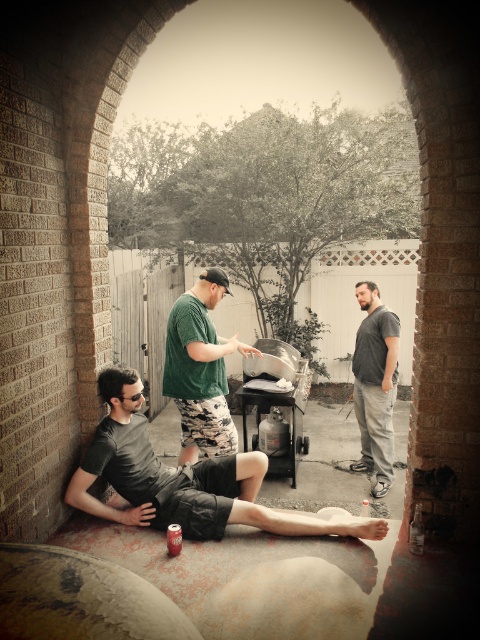
Based on the scene described, which object is shorter in height between the dark gray cotton shorts at lower left and the green matte shirt at center?

The dark gray cotton shorts at lower left is shorter in height compared to the green matte shirt at center.